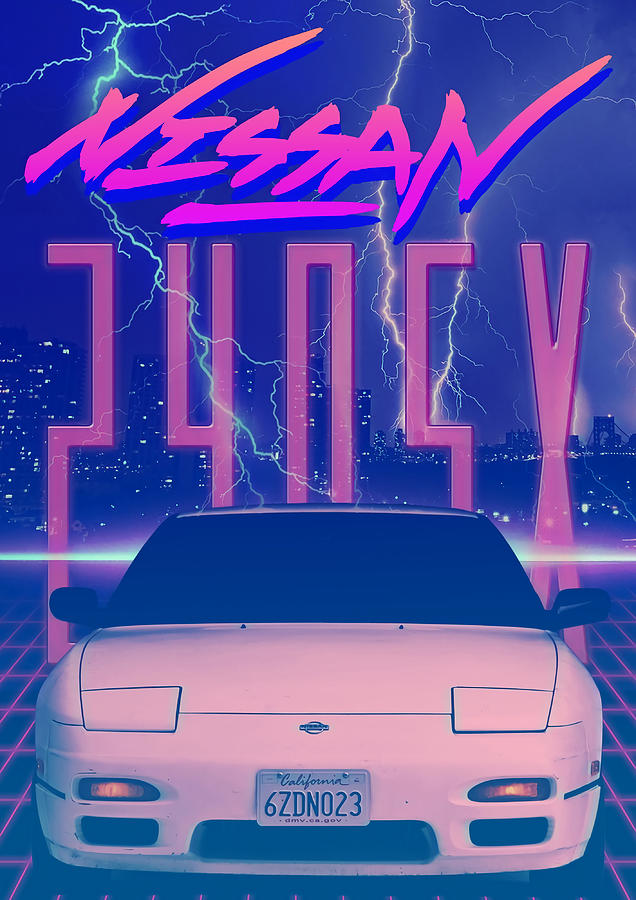
The width and height of the screenshot is (636, 900). What are the coordinates of `hood` in the screenshot? It's located at (318, 698).